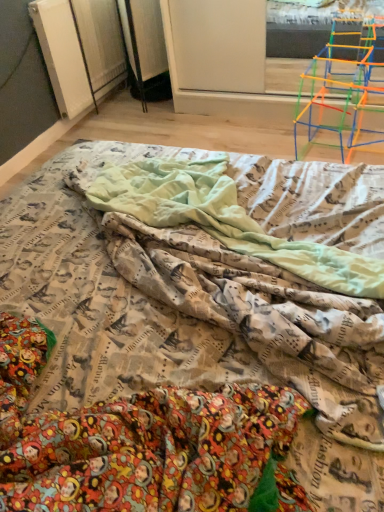
This screenshot has width=384, height=512. What do you see at coordinates (237, 218) in the screenshot?
I see `printed fabric blanket at center` at bounding box center [237, 218].

Describe the element at coordinates (187, 345) in the screenshot. I see `printed fabric bed at center` at that location.

Image resolution: width=384 pixels, height=512 pixels. In order to click on translucent plastic toy at upper right in this screenshot , I will do `click(344, 80)`.

Which is in front, printed fabric bed at center or printed fabric blanket at center?

printed fabric bed at center is closer to the camera.

Can you confirm if printed fabric bed at center is bigger than printed fabric blanket at center?

Yes.

From a real-world perspective, is printed fabric bed at center over printed fabric blanket at center?

Yes, from a real-world perspective, printed fabric bed at center is on top of printed fabric blanket at center.

Could you tell me if printed fabric blanket at center is turned towards printed fabric bed at center?

Yes, printed fabric blanket at center is aimed at printed fabric bed at center.

Consider the image. From the image's perspective, would you say printed fabric blanket at center is shown under printed fabric bed at center?

Actually, printed fabric blanket at center appears above printed fabric bed at center in the image.

Between printed fabric blanket at center and printed fabric bed at center, which one is positioned in front?

Positioned in front is printed fabric bed at center.

Is printed fabric blanket at center taller or shorter than printed fabric bed at center?

Considering their sizes, printed fabric blanket at center has less height than printed fabric bed at center.

Is the surface of translucent plastic toy at upper right in direct contact with printed fabric bed at center?

No, translucent plastic toy at upper right is not making contact with printed fabric bed at center.

From a real-world perspective, which is physically below, translucent plastic toy at upper right or printed fabric bed at center?

translucent plastic toy at upper right, from a real-world perspective.

In terms of width, does printed fabric bed at center look wider or thinner when compared to translucent plastic toy at upper right?

Clearly, printed fabric bed at center has more width compared to translucent plastic toy at upper right.

Between printed fabric bed at center and translucent plastic toy at upper right, which one has less height?

With less height is translucent plastic toy at upper right.

Would you say printed fabric bed at center contains translucent plastic toy at upper right?

Definitely not — translucent plastic toy at upper right is not inside printed fabric bed at center.

Considering the positions of objects printed fabric bed at center and translucent plastic toy at upper right in the image provided, who is more to the left, printed fabric bed at center or translucent plastic toy at upper right?

printed fabric bed at center is more to the left.

Does translucent plastic toy at upper right come in front of printed fabric blanket at center?

No.

Considering the sizes of objects translucent plastic toy at upper right and printed fabric blanket at center in the image provided, who is thinner, translucent plastic toy at upper right or printed fabric blanket at center?

With smaller width is translucent plastic toy at upper right.

From the image's perspective, which object appears higher, translucent plastic toy at upper right or printed fabric blanket at center?

translucent plastic toy at upper right is shown above in the image.

How distant is translucent plastic toy at upper right from printed fabric blanket at center?

translucent plastic toy at upper right and printed fabric blanket at center are 38.95 inches apart from each other.

Between point (354, 255) and point (321, 92), which one is positioned in front?

The point (354, 255) is more forward.

Would you say printed fabric blanket at center is to the left or to the right of translucent plastic toy at upper right in the picture?

Based on their positions, printed fabric blanket at center is located to the left of translucent plastic toy at upper right.

Is printed fabric blanket at center oriented away from translucent plastic toy at upper right?

That's not correct — printed fabric blanket at center is not looking away from translucent plastic toy at upper right.

Identify the location of bed that is in front of the printed fabric blanket at center. (187, 345).

Identify the location of bed located above the printed fabric blanket at center (from a real-world perspective). (187, 345).

Based on their spatial positions, is printed fabric blanket at center or printed fabric bed at center closer to translucent plastic toy at upper right?

printed fabric blanket at center is closer to translucent plastic toy at upper right.

From the image, which object appears to be nearer to printed fabric bed at center, translucent plastic toy at upper right or printed fabric blanket at center?

Among the two, printed fabric blanket at center is located nearer to printed fabric bed at center.

From the image, which object appears to be farther from translucent plastic toy at upper right, printed fabric bed at center or printed fabric blanket at center?

The object further to translucent plastic toy at upper right is printed fabric bed at center.

Looking at the image, which one is located further to printed fabric blanket at center, translucent plastic toy at upper right or printed fabric bed at center?

translucent plastic toy at upper right.

Considering their positions, is printed fabric blanket at center positioned closer to printed fabric bed at center than translucent plastic toy at upper right?

Among the two, printed fabric blanket at center is located nearer to printed fabric bed at center.

Considering their positions, is printed fabric bed at center positioned further to printed fabric blanket at center than translucent plastic toy at upper right?

Among the two, translucent plastic toy at upper right is located further to printed fabric blanket at center.

The height and width of the screenshot is (512, 384). I want to click on blanket between printed fabric bed at center and translucent plastic toy at upper right from front to back, so click(237, 218).